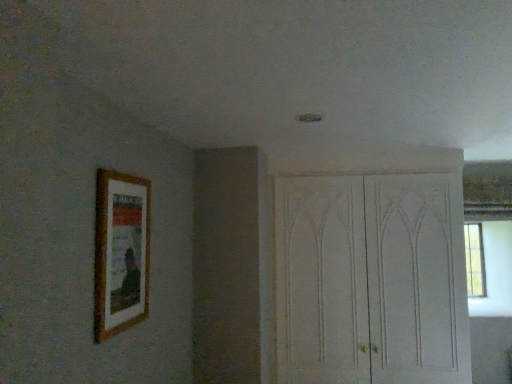
Question: Do you think white wood dresser at right is within wooden picture frame at left, or outside of it?

Choices:
 (A) inside
 (B) outside

Answer: (B)

Question: Considering the relative positions of white wood dresser at right and wooden picture frame at left in the image provided, is white wood dresser at right to the left or to the right of wooden picture frame at left?

Choices:
 (A) right
 (B) left

Answer: (A)

Question: Is white wood dresser at right in front of or behind wooden picture frame at left in the image?

Choices:
 (A) front
 (B) behind

Answer: (B)

Question: From the image's perspective, is wooden picture frame at left located above or below white wood dresser at right?

Choices:
 (A) above
 (B) below

Answer: (A)

Question: In terms of size, does wooden picture frame at left appear bigger or smaller than white wood dresser at right?

Choices:
 (A) big
 (B) small

Answer: (B)

Question: Relative to white wood dresser at right, is wooden picture frame at left in front or behind?

Choices:
 (A) front
 (B) behind

Answer: (A)

Question: Is wooden picture frame at left situated inside white wood dresser at right or outside?

Choices:
 (A) inside
 (B) outside

Answer: (B)